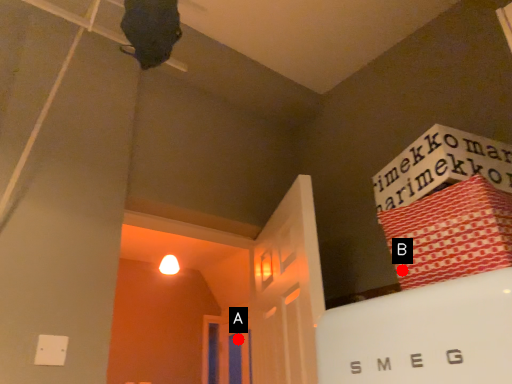
Question: Two points are circled on the image, labeled by A and B beside each circle. Among these points, which one is nearest to the camera?

Choices:
 (A) A is closer
 (B) B is closer

Answer: (B)